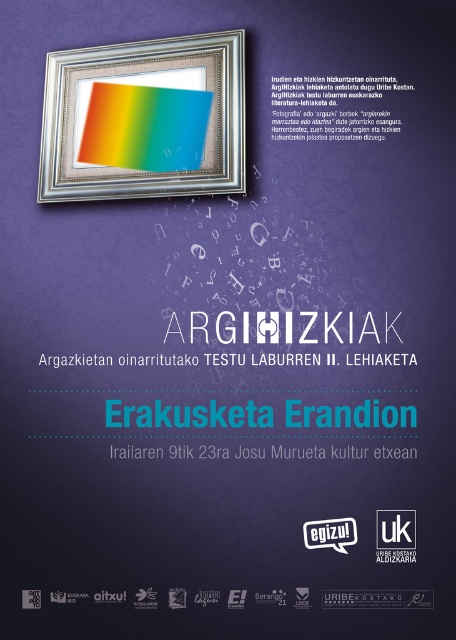
You are an event organizer checking the promotional poster for the event. You need to ensure that the silver metallic picture frame at upper center and the rainbow paper at upper center are arranged properly. Based on their sizes, which object should be placed higher to avoid overlapping?

The silver metallic picture frame at upper center is much taller than the rainbow paper at upper center. To avoid overlapping, the silver metallic picture frame at upper center should be placed higher since it is taller and requires more vertical space.

Based on the photo, you are designing a layout for a promotional poster and need to place the silver metallic picture frame at upper center and the rainbow paper at upper center. According to the image, which object is positioned to the left?

The silver metallic picture frame at upper center is to the left of the rainbow paper at upper center.